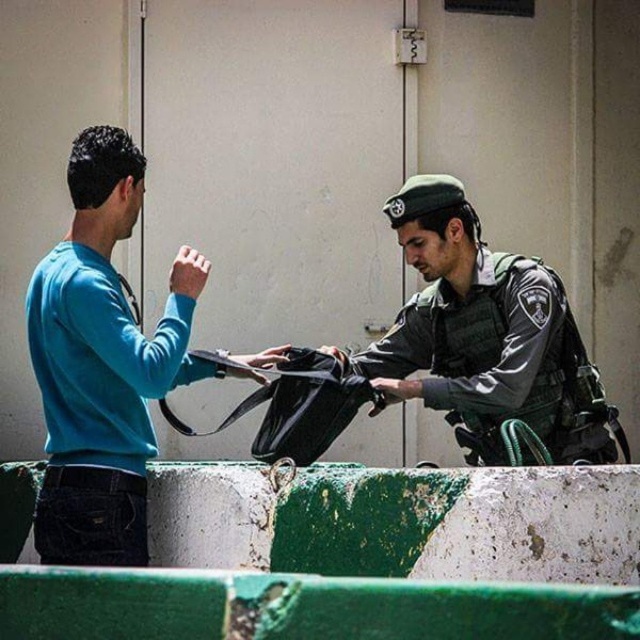
The width and height of the screenshot is (640, 640). Find the location of `teal matte sweater at left`. teal matte sweater at left is located at coordinates click(102, 362).

Is teal matte sweater at left above green uniformed officer at center?

Yes.

Where is `teal matte sweater at left`? teal matte sweater at left is located at coordinates (102, 362).